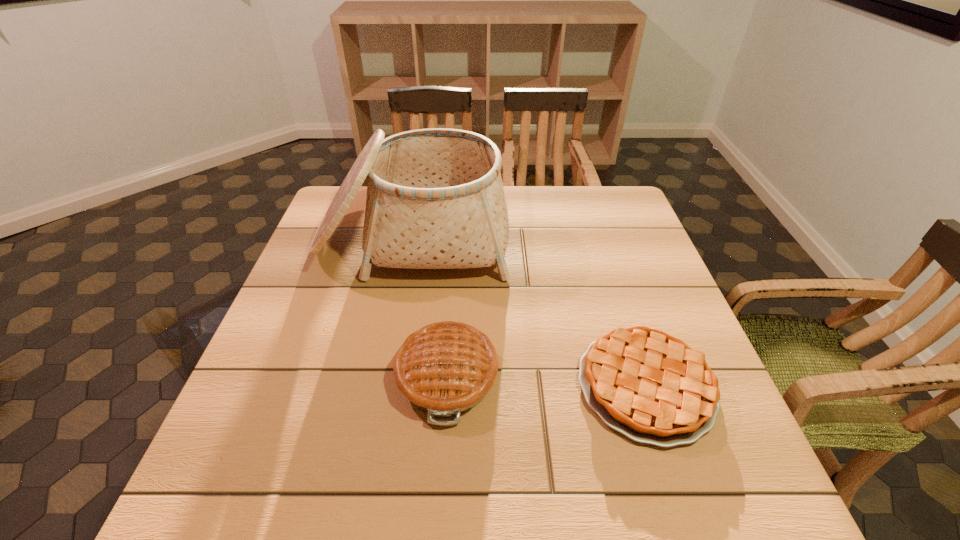
The height and width of the screenshot is (540, 960). I want to click on vacant space in between the tallest object and the rightmost object, so click(529, 312).

Where is `free space between the left pie and the basket`? The width and height of the screenshot is (960, 540). free space between the left pie and the basket is located at coordinates (430, 307).

Image resolution: width=960 pixels, height=540 pixels. In order to click on vacant area that lies between the shortest object and the farthest object in this screenshot , I will do `click(529, 312)`.

This screenshot has height=540, width=960. I want to click on vacant point located between the second tallest object and the shortest object, so (546, 381).

Identify the location of free space between the taller pie and the right pie. (546, 381).

This screenshot has width=960, height=540. Identify the location of vacant area that lies between the farthest object and the left pie. (430, 307).

The width and height of the screenshot is (960, 540). Find the location of `blank region between the left pie and the farthest object`. blank region between the left pie and the farthest object is located at coordinates (430, 307).

The width and height of the screenshot is (960, 540). In order to click on the second closest object to the left pie in this screenshot , I will do `click(652, 387)`.

This screenshot has width=960, height=540. Identify the location of the closest object relative to the shorter pie. (445, 368).

Identify the location of free location that satisfies the following two spatial constraints: 1. with the lid open on the farthest object; 2. on the right side of the right pie. (385, 386).